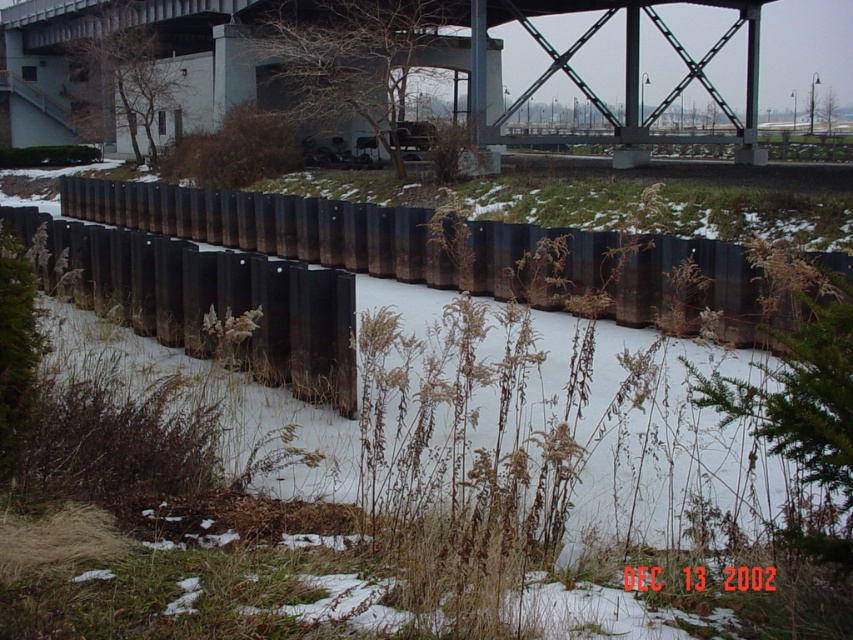
You are a painter who wants to paint the rusty metal fence at center and the metallic gray bridge at upper center. Since you have limited canvas space, you need to know which object is narrower so you can paint it smaller. Which one should you paint smaller?

The rusty metal fence at center has a lesser width compared to the metallic gray bridge at upper center, so you should paint the rusty metal fence at center smaller to accurately represent its narrower width.

You are a photographer standing at the edge of the rusty metal fence at center, aiming to capture the metallic gray bridge at upper center in your shot. Based on their heights, will the fence block the view of the bridge?

The rusty metal fence at center is shorter than the metallic gray bridge at upper center, so the fence will not block the view of the bridge since it is lower in height.